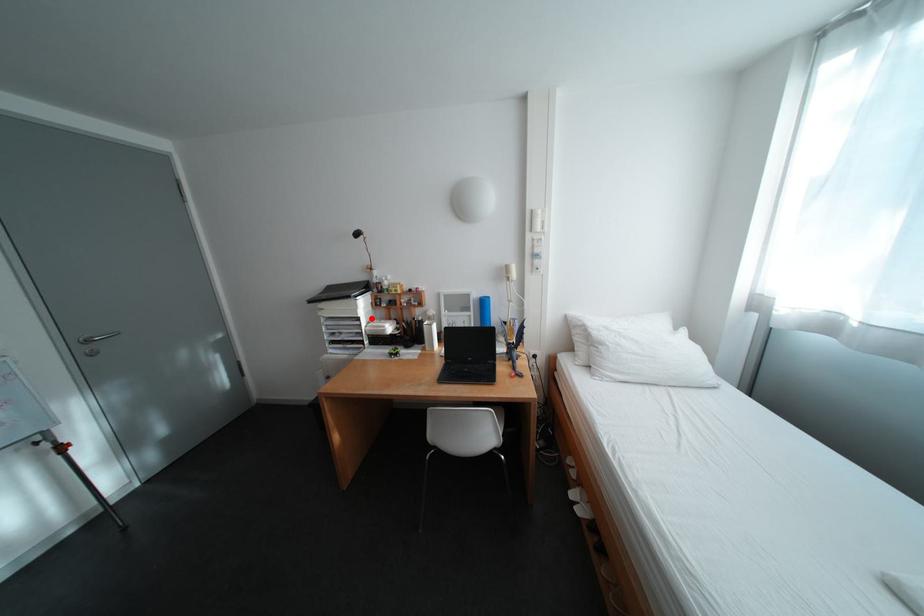
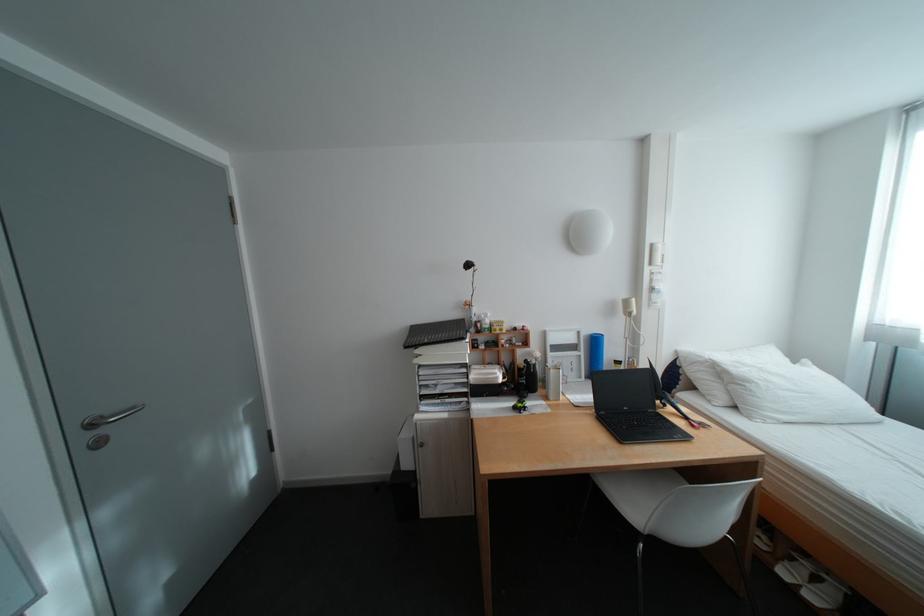
Question: A red point is marked in image1. In image2, is the corresponding 3D point closer to the camera or farther? Reply with the corresponding letter.

Choices:
 (A) The corresponding 3D point is closer.
 (B) The corresponding 3D point is farther.

Answer: (B)